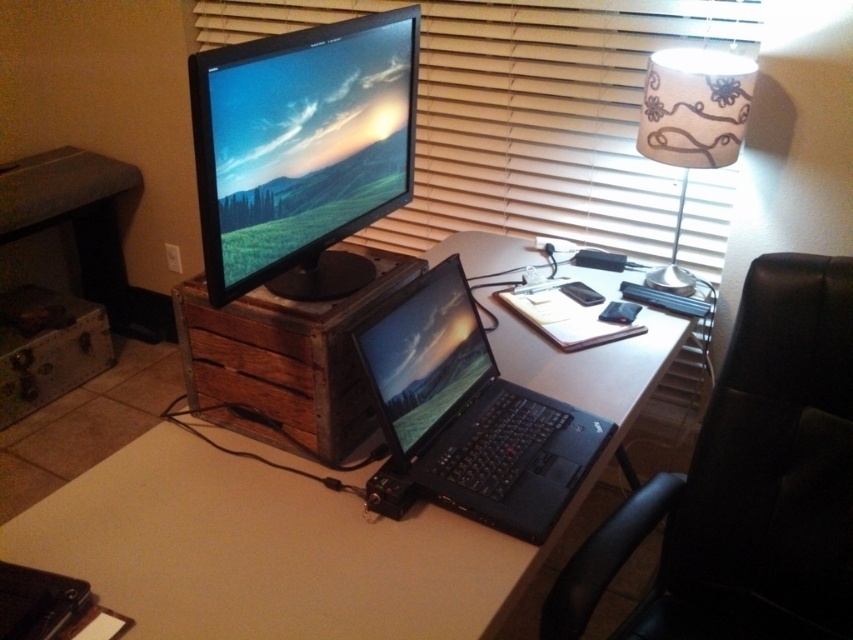
You are sitting in the black leather swivel chair at right and want to reach the black glossy laptop at center. Which direction should you turn to face the laptop?

Since the black leather swivel chair at right is to the right of the black glossy laptop at center, you should turn left to face the laptop.

You are setting up a new monitor stand for the satin black monitor at upper center and the black matte laptop at center. The stand can only accommodate one device at a time. Based on their heights, which device should you place on the stand first to ensure stability?

The satin black monitor at upper center should be placed on the stand first because it has a greater height than the black matte laptop at center, ensuring stability by placing the taller device first.

You are sitting in the black leather swivel chair at right and want to reach the black glossy laptop at center. Is the laptop closer to you or further away from you?

The black leather swivel chair at right is closer to the viewer than the black glossy laptop at center, so the laptop is further away from you.